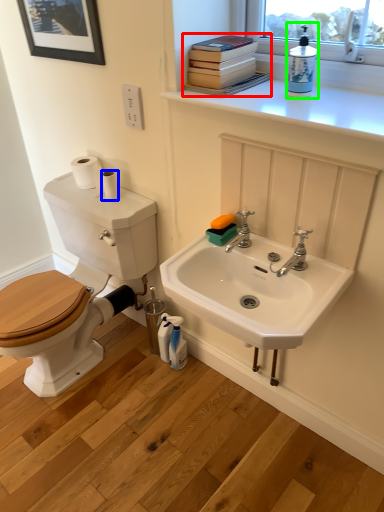
Question: Considering the real-world distances, which object is closest to book (highlighted by a red box)? toilet paper (highlighted by a blue box) or cleaning product (highlighted by a green box).

Choices:
 (A) toilet paper
 (B) cleaning product

Answer: (B)